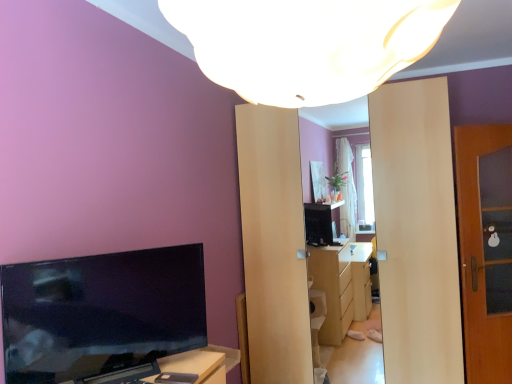
Question: Would you say black matte mobile phone at lower center is outside white matte lampshade at upper center?

Choices:
 (A) no
 (B) yes

Answer: (B)

Question: Is black matte mobile phone at lower center further to camera compared to white matte lampshade at upper center?

Choices:
 (A) yes
 (B) no

Answer: (A)

Question: From a real-world perspective, is black matte mobile phone at lower center beneath white matte lampshade at upper center?

Choices:
 (A) yes
 (B) no

Answer: (A)

Question: Is white matte lampshade at upper center surrounded by black matte mobile phone at lower center?

Choices:
 (A) yes
 (B) no

Answer: (B)

Question: Is black matte mobile phone at lower center aimed at white matte lampshade at upper center?

Choices:
 (A) yes
 (B) no

Answer: (B)

Question: Is black glossy tv at left taller or shorter than wooden door at right?

Choices:
 (A) tall
 (B) short

Answer: (B)

Question: Is black glossy tv at left situated inside wooden door at right or outside?

Choices:
 (A) inside
 (B) outside

Answer: (B)

Question: In the image, is black glossy tv at left positioned in front of or behind wooden door at right?

Choices:
 (A) front
 (B) behind

Answer: (A)

Question: From the image's perspective, is black glossy tv at left located above or below wooden door at right?

Choices:
 (A) below
 (B) above

Answer: (A)

Question: Considering their positions, is black matte mobile phone at lower center located in front of or behind wooden door at right?

Choices:
 (A) behind
 (B) front

Answer: (B)

Question: In terms of size, does black matte mobile phone at lower center appear bigger or smaller than wooden door at right?

Choices:
 (A) small
 (B) big

Answer: (A)

Question: Is black matte mobile phone at lower center situated inside wooden door at right or outside?

Choices:
 (A) inside
 (B) outside

Answer: (B)

Question: Is point (169, 375) closer or farther from the camera than point (482, 319)?

Choices:
 (A) farther
 (B) closer

Answer: (B)

Question: Considering the positions of point (479, 317) and point (294, 39), is point (479, 317) closer or farther from the camera than point (294, 39)?

Choices:
 (A) farther
 (B) closer

Answer: (A)

Question: Do you think wooden door at right is within white matte lampshade at upper center, or outside of it?

Choices:
 (A) outside
 (B) inside

Answer: (A)